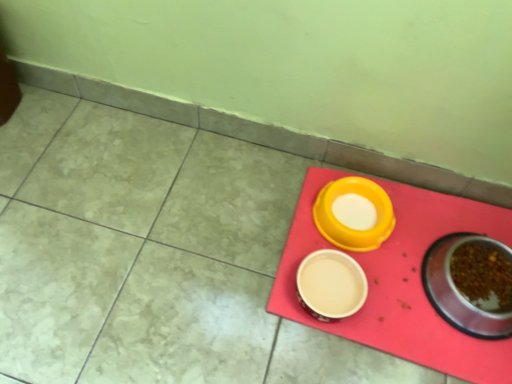
You are a GUI agent. You are given a task and a screenshot of the screen. Output one action in this format:
    pyautogui.click(x=<x>, y=<y>)
    Task: Click on the vacant area that lies between metallic stainless steel bowl at lower right, the third tableware positioned from the left, and beige ceramic bowl at center, the first tableware in the left-to-right sequence
    This screenshot has width=512, height=384.
    Given the screenshot: What is the action you would take?
    pyautogui.click(x=400, y=291)